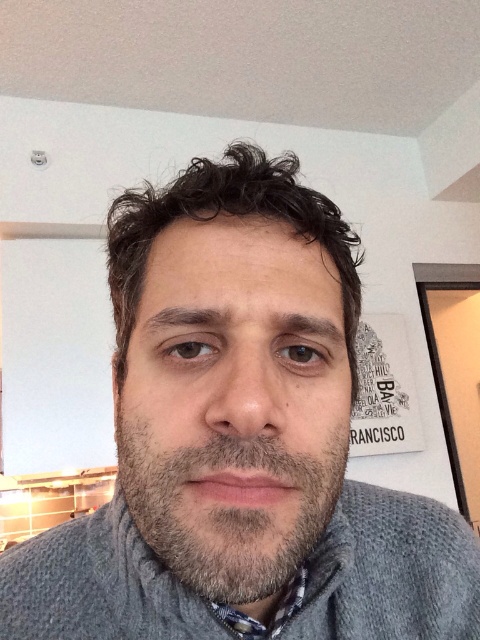
Looking at the person in the image, where is the gray matte beard at center in relation to the dark brown curly hair at center?

The gray matte beard at center is to the right of the dark brown curly hair at center.

You are standing in a room and see two points marked on the wall. The first point is at position point (x=251, y=550) and the second is at point (x=269, y=632). Which point is closer to you?

Point (x=251, y=550) is closer to the camera than point (x=269, y=632).

You are a photographer adjusting the camera focus. You need to ensure both the gray matte beard at center and the patterned fabric shirt at lower center are in focus. Which object should you focus on first to make sure both are sharp?

You should focus on the gray matte beard at center first because it is much taller than the patterned fabric shirt at lower center, so focusing on the closer object first will ensure both are in focus.